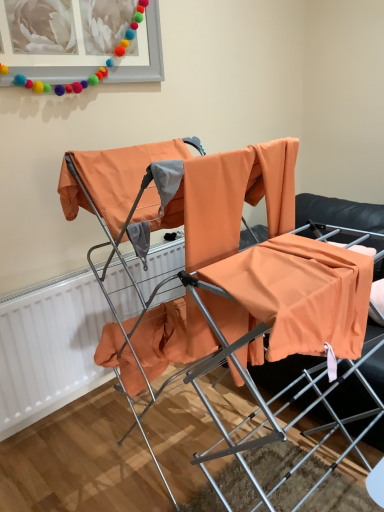
Question: Could you tell me if white matte radiator at left is facing orange fabric chair at center?

Choices:
 (A) yes
 (B) no

Answer: (A)

Question: Is white matte radiator at left far from orange fabric chair at center?

Choices:
 (A) yes
 (B) no

Answer: (B)

Question: Considering the relative positions of white matte radiator at left and orange fabric chair at center in the image provided, is white matte radiator at left to the left of orange fabric chair at center from the viewer's perspective?

Choices:
 (A) no
 (B) yes

Answer: (B)

Question: Is white matte radiator at left bigger than orange fabric chair at center?

Choices:
 (A) no
 (B) yes

Answer: (A)

Question: Does white matte radiator at left appear on the right side of orange fabric chair at center?

Choices:
 (A) no
 (B) yes

Answer: (A)

Question: Considering the relative positions of white matte radiator at left and matte gray picture frame at upper left in the image provided, is white matte radiator at left to the left or to the right of matte gray picture frame at upper left?

Choices:
 (A) left
 (B) right

Answer: (B)

Question: From a real-world perspective, is white matte radiator at left physically located above or below matte gray picture frame at upper left?

Choices:
 (A) below
 (B) above

Answer: (A)

Question: Considering the positions of point (46, 356) and point (6, 17), is point (46, 356) closer or farther from the camera than point (6, 17)?

Choices:
 (A) farther
 (B) closer

Answer: (A)

Question: From the image's perspective, is white matte radiator at left located above or below matte gray picture frame at upper left?

Choices:
 (A) below
 (B) above

Answer: (A)

Question: From their relative heights in the image, would you say white matte radiator at left is taller or shorter than orange fabric chair at center?

Choices:
 (A) short
 (B) tall

Answer: (A)

Question: Is white matte radiator at left wider or thinner than orange fabric chair at center?

Choices:
 (A) wide
 (B) thin

Answer: (B)

Question: In the image, is white matte radiator at left positioned in front of or behind orange fabric chair at center?

Choices:
 (A) behind
 (B) front

Answer: (A)

Question: From the image's perspective, is white matte radiator at left above or below orange fabric chair at center?

Choices:
 (A) above
 (B) below

Answer: (B)

Question: Visually, is matte gray picture frame at upper left positioned to the left or to the right of orange fabric chair at center?

Choices:
 (A) left
 (B) right

Answer: (A)

Question: In terms of height, does matte gray picture frame at upper left look taller or shorter compared to orange fabric chair at center?

Choices:
 (A) short
 (B) tall

Answer: (A)